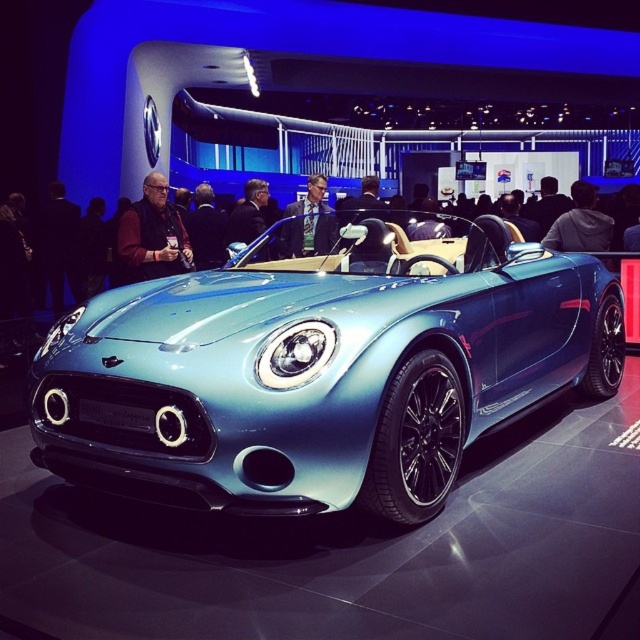
Is metallic blue sports car at center below matte black jacket at center?

Correct, metallic blue sports car at center is located below matte black jacket at center.

Between metallic blue sports car at center and matte black jacket at center, which one appears on the left side from the viewer's perspective?

Positioned to the left is matte black jacket at center.

You are a GUI agent. You are given a task and a screenshot of the screen. Output one action in this format:
    pyautogui.click(x=<x>, y=<y>)
    Task: Click on the metallic blue sports car at center
    The width and height of the screenshot is (640, 640).
    Given the screenshot: What is the action you would take?
    pyautogui.click(x=321, y=371)

Is point (160, 250) behind point (294, 209)?

No, (160, 250) is closer to viewer.

Looking at this image, can you confirm if matte black jacket at center is positioned below light blue fabric suit at center?

Actually, matte black jacket at center is above light blue fabric suit at center.

What are the coordinates of `matte black jacket at center` in the screenshot? It's located at (152, 236).

At what (x,y) coordinates should I click in order to perform the action: click on matte black jacket at center. Please return your answer as a coordinate pair (x, y). Image resolution: width=640 pixels, height=640 pixels. Looking at the image, I should click on (152, 236).

Who is lower down, metallic blue sports car at center or light blue fabric suit at center?

metallic blue sports car at center

Between point (563, 352) and point (314, 221), which one is positioned behind?

Positioned behind is point (314, 221).

You are a GUI agent. You are given a task and a screenshot of the screen. Output one action in this format:
    pyautogui.click(x=<x>, y=<y>)
    Task: Click on the metallic blue sports car at center
    The image size is (640, 640).
    Given the screenshot: What is the action you would take?
    pyautogui.click(x=321, y=371)